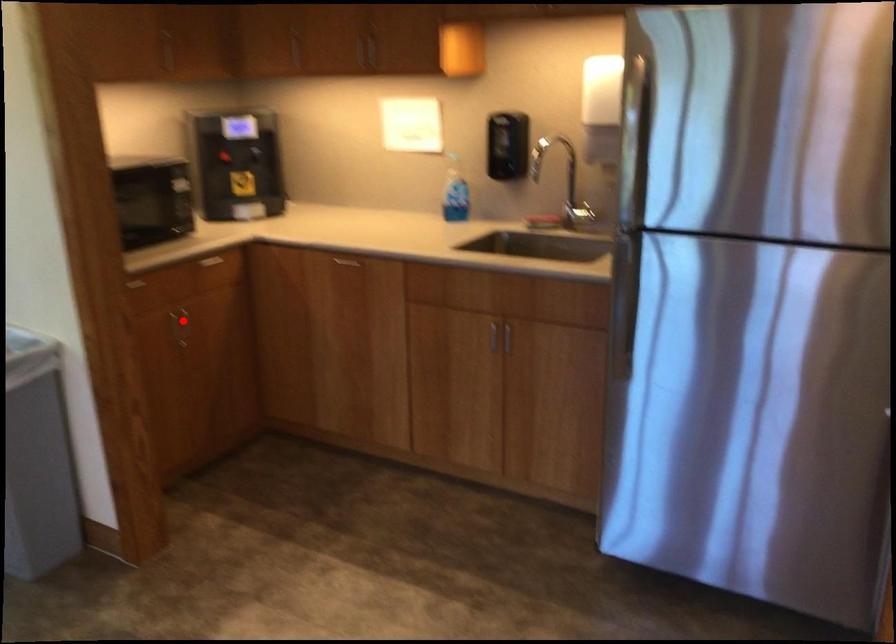
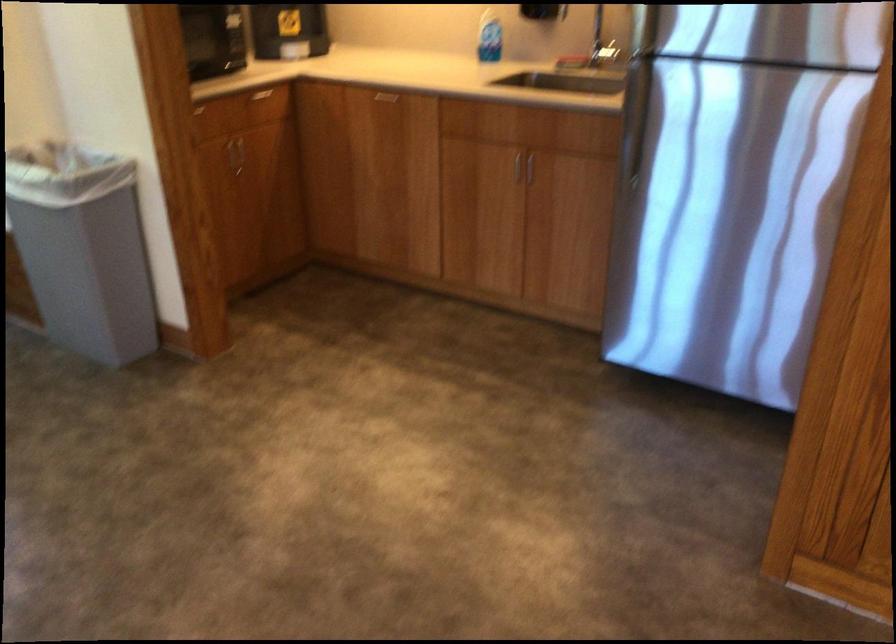
In the second image, find the point that corresponds to the highlighted location in the first image.

(239, 151)